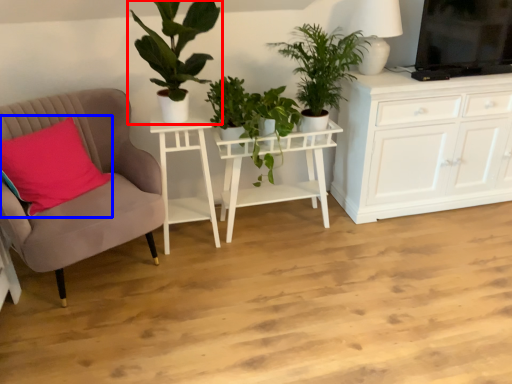
Question: Which point is further to the camera, houseplant (highlighted by a red box) or pillow (highlighted by a blue box)?

Choices:
 (A) houseplant
 (B) pillow

Answer: (B)